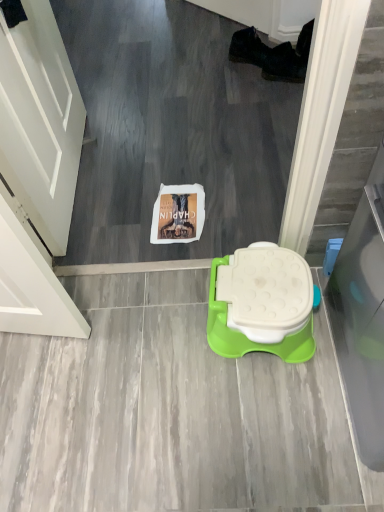
Question: Would you say white matte door at upper left is inside or outside white plastic toilet at center?

Choices:
 (A) inside
 (B) outside

Answer: (B)

Question: Considering the positions of point (16, 182) and point (263, 248), is point (16, 182) closer or farther from the camera than point (263, 248)?

Choices:
 (A) closer
 (B) farther

Answer: (A)

Question: Is white matte door at upper left wider or thinner than white plastic toilet at center?

Choices:
 (A) wide
 (B) thin

Answer: (B)

Question: Based on their positions, is white plastic toilet at center located to the left or right of white matte door at upper left?

Choices:
 (A) right
 (B) left

Answer: (A)

Question: In the image, is white plastic toilet at center positioned in front of or behind white matte door at upper left?

Choices:
 (A) front
 (B) behind

Answer: (B)

Question: Considering the positions of white plastic toilet at center and white matte door at upper left in the image, is white plastic toilet at center wider or thinner than white matte door at upper left?

Choices:
 (A) thin
 (B) wide

Answer: (B)

Question: From a real-world perspective, is white plastic toilet at center physically located above or below white matte door at upper left?

Choices:
 (A) below
 (B) above

Answer: (A)